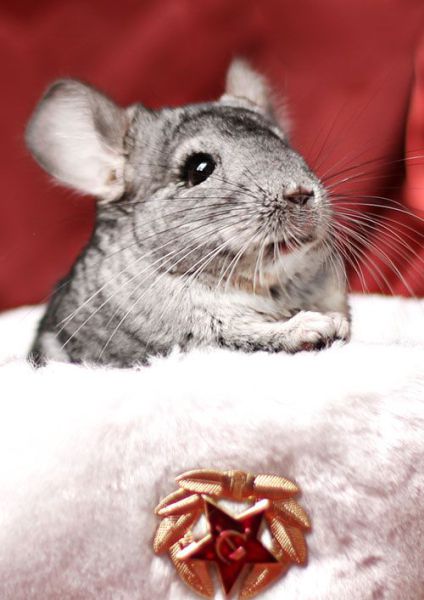
Locate an element on the screen. shadowed blanket is located at coordinates (104, 557).